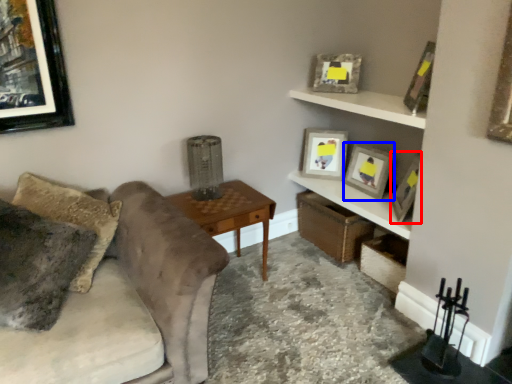
Question: Which object is closer to the camera taking this photo, picture frame (highlighted by a red box) or picture frame (highlighted by a blue box)?

Choices:
 (A) picture frame
 (B) picture frame

Answer: (A)